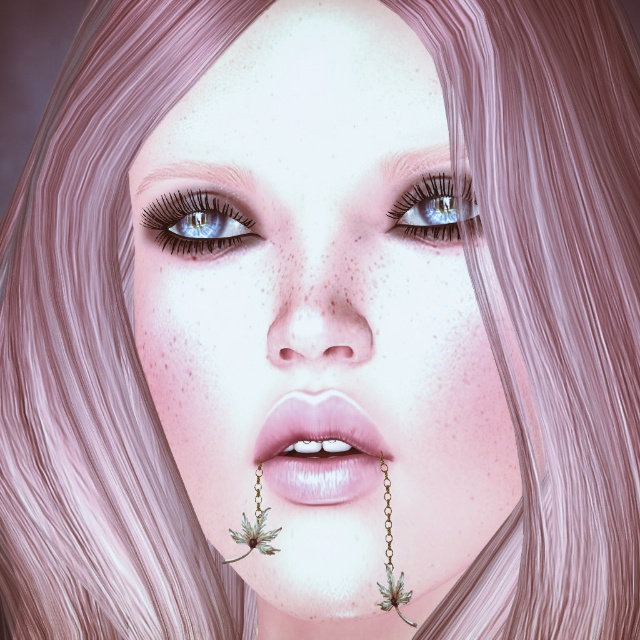
Who is higher up, smooth skin face at center or gold chain leaf at lower center?

Positioned higher is smooth skin face at center.

Is smooth skin face at center above gold chain leaf at lower center?

Yes.

Locate an element on the screen. smooth skin face at center is located at coordinates (321, 323).

Between matte pink lips at center and gold metallic leaf at lower center, which one appears on the right side from the viewer's perspective?

From the viewer's perspective, matte pink lips at center appears more on the right side.

Looking at this image, is matte pink lips at center thinner than gold metallic leaf at lower center?

No, matte pink lips at center is not thinner than gold metallic leaf at lower center.

Locate an element on the screen. The image size is (640, 640). matte pink lips at center is located at coordinates (320, 449).

Which of these two, shiny blue eye at upper left or gold metallic leaf at lower center, stands taller?

With more height is gold metallic leaf at lower center.

Between point (202, 212) and point (259, 497), which one is positioned behind?

Point (202, 212)

Locate an element on the screen. shiny blue eye at upper left is located at coordinates (196, 221).